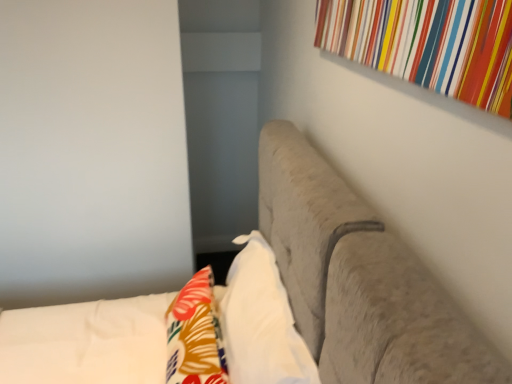
What are the coordinates of `suede-like beige headboard at upper right` in the screenshot? It's located at (359, 280).

What do you see at coordinates (359, 280) in the screenshot? I see `suede-like beige headboard at upper right` at bounding box center [359, 280].

Describe the element at coordinates (195, 334) in the screenshot. I see `floral fabric throw pillow at lower left` at that location.

This screenshot has width=512, height=384. I want to click on suede-like beige headboard at upper right, so click(359, 280).

Is the surface of floral fabric throw pillow at lower left in direct contact with white soft pillow at center?

No, floral fabric throw pillow at lower left is not making contact with white soft pillow at center.

Looking at this image, which is more to the left, floral fabric throw pillow at lower left or white soft pillow at center?

floral fabric throw pillow at lower left.

Considering the relative sizes of suede-like beige headboard at upper right and floral fabric throw pillow at lower left in the image provided, is suede-like beige headboard at upper right smaller than floral fabric throw pillow at lower left?

No, suede-like beige headboard at upper right is not smaller than floral fabric throw pillow at lower left.

Which is farther from the camera, (333, 335) or (209, 353)?

The point (209, 353) is farther.

Is suede-like beige headboard at upper right positioned behind floral fabric throw pillow at lower left?

No, suede-like beige headboard at upper right is closer to the camera.

What's the angular difference between suede-like beige headboard at upper right and floral fabric throw pillow at lower left's facing directions?

There is a 3.72-degree angle between the facing directions of suede-like beige headboard at upper right and floral fabric throw pillow at lower left.

Is floral fabric throw pillow at lower left oriented away from suede-like beige headboard at upper right?

Yes, suede-like beige headboard at upper right is at the back of floral fabric throw pillow at lower left.

Based on the photo, which point is more distant from viewer, (168, 372) or (441, 371)?

The point (168, 372) is farther.

Based on their sizes in the image, would you say floral fabric throw pillow at lower left is bigger or smaller than suede-like beige headboard at upper right?

In the image, floral fabric throw pillow at lower left appears to be smaller than suede-like beige headboard at upper right.

From a real-world perspective, which is physically below, floral fabric throw pillow at lower left or suede-like beige headboard at upper right?

From a 3D spatial view, suede-like beige headboard at upper right is below.

From the image's perspective, is white soft pillow at center below suede-like beige headboard at upper right?

Incorrect, from the image's perspective, white soft pillow at center is higher than suede-like beige headboard at upper right.

Which is correct: white soft pillow at center is inside suede-like beige headboard at upper right, or outside of it?

white soft pillow at center is enclosed within suede-like beige headboard at upper right.

Is white soft pillow at center facing away from suede-like beige headboard at upper right?

That's right, white soft pillow at center is facing away from suede-like beige headboard at upper right.

Image resolution: width=512 pixels, height=384 pixels. Identify the location of furniture that is below the white soft pillow at center (from the image's perspective). (359, 280).

From the image's perspective, would you say suede-like beige headboard at upper right is shown under white soft pillow at center?

Correct, suede-like beige headboard at upper right appears lower than white soft pillow at center in the image.

Does point (347, 189) appear closer or farther from the camera than point (247, 317)?

Point (347, 189).

Between suede-like beige headboard at upper right and white soft pillow at center, which one has larger size?

With larger size is suede-like beige headboard at upper right.

Considering the sizes of suede-like beige headboard at upper right and white soft pillow at center in the image, is suede-like beige headboard at upper right taller or shorter than white soft pillow at center?

In the image, suede-like beige headboard at upper right appears to be taller than white soft pillow at center.

Where is `pillow above the floral fabric throw pillow at lower left (from the image's perspective)`? Image resolution: width=512 pixels, height=384 pixels. pillow above the floral fabric throw pillow at lower left (from the image's perspective) is located at coordinates (261, 321).

Is white soft pillow at center situated inside floral fabric throw pillow at lower left or outside?

white soft pillow at center lies outside floral fabric throw pillow at lower left.

Between white soft pillow at center and floral fabric throw pillow at lower left, which one has more height?

With more height is white soft pillow at center.

At what (x,y) coordinates should I click in order to perform the action: click on throw pillow below the white soft pillow at center (from the image's perspective). Please return your answer as a coordinate pair (x, y). Looking at the image, I should click on click(195, 334).

The image size is (512, 384). Identify the location of throw pillow above the suede-like beige headboard at upper right (from a real-world perspective). (195, 334).

From the picture: When comparing their distances from floral fabric throw pillow at lower left, does white soft pillow at center or suede-like beige headboard at upper right seem further?

Among the two, suede-like beige headboard at upper right is located further to floral fabric throw pillow at lower left.

Looking at the image, which one is located closer to suede-like beige headboard at upper right, floral fabric throw pillow at lower left or white soft pillow at center?

The object closer to suede-like beige headboard at upper right is white soft pillow at center.

Based on their spatial positions, is suede-like beige headboard at upper right or white soft pillow at center closer to floral fabric throw pillow at lower left?

The object closer to floral fabric throw pillow at lower left is white soft pillow at center.

Estimate the real-world distances between objects in this image. Which object is closer to suede-like beige headboard at upper right, white soft pillow at center or floral fabric throw pillow at lower left?

white soft pillow at center is positioned closer to the anchor suede-like beige headboard at upper right.

Based on their spatial positions, is floral fabric throw pillow at lower left or suede-like beige headboard at upper right closer to white soft pillow at center?

Among the two, floral fabric throw pillow at lower left is located nearer to white soft pillow at center.

Estimate the real-world distances between objects in this image. Which object is closer to white soft pillow at center, suede-like beige headboard at upper right or floral fabric throw pillow at lower left?

Based on the image, floral fabric throw pillow at lower left appears to be nearer to white soft pillow at center.

At what (x,y) coordinates should I click in order to perform the action: click on pillow between suede-like beige headboard at upper right and floral fabric throw pillow at lower left in the front-back direction. Please return your answer as a coordinate pair (x, y). The image size is (512, 384). Looking at the image, I should click on tap(261, 321).